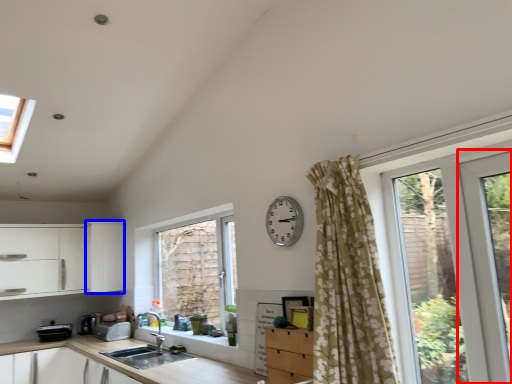
Question: Which point is closer to the camera, screen door (highlighted by a red box) or cabinetry (highlighted by a blue box)?

Choices:
 (A) screen door
 (B) cabinetry

Answer: (A)